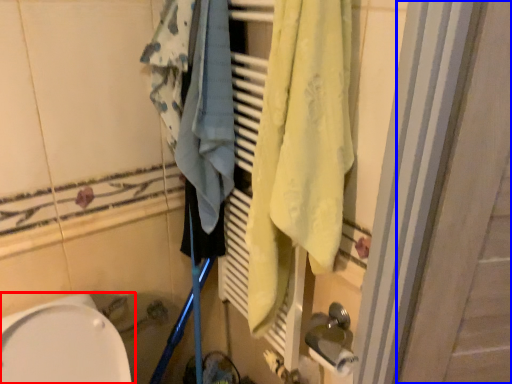
Question: Among these objects, which one is nearest to the camera, toilet (highlighted by a red box) or screen door (highlighted by a blue box)?

Choices:
 (A) toilet
 (B) screen door

Answer: (A)